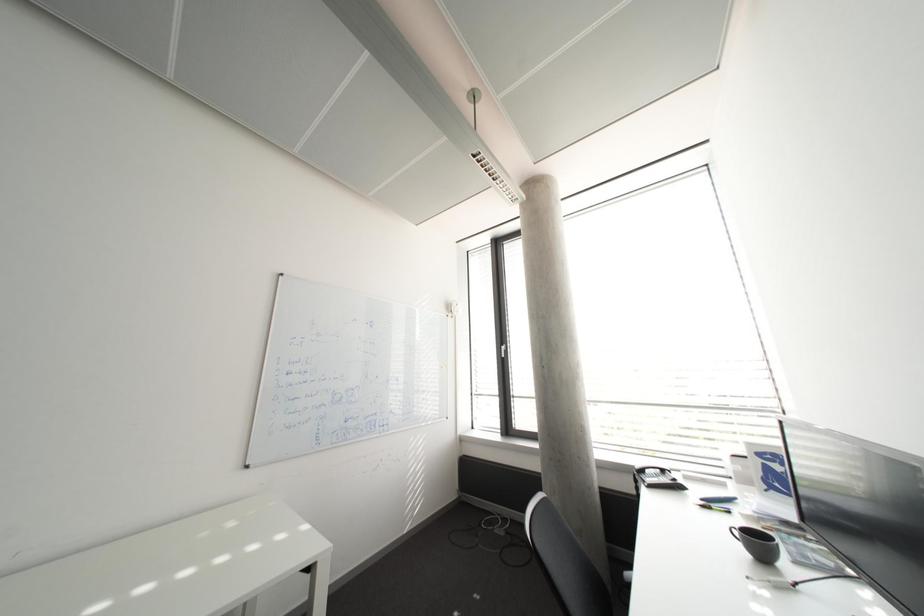
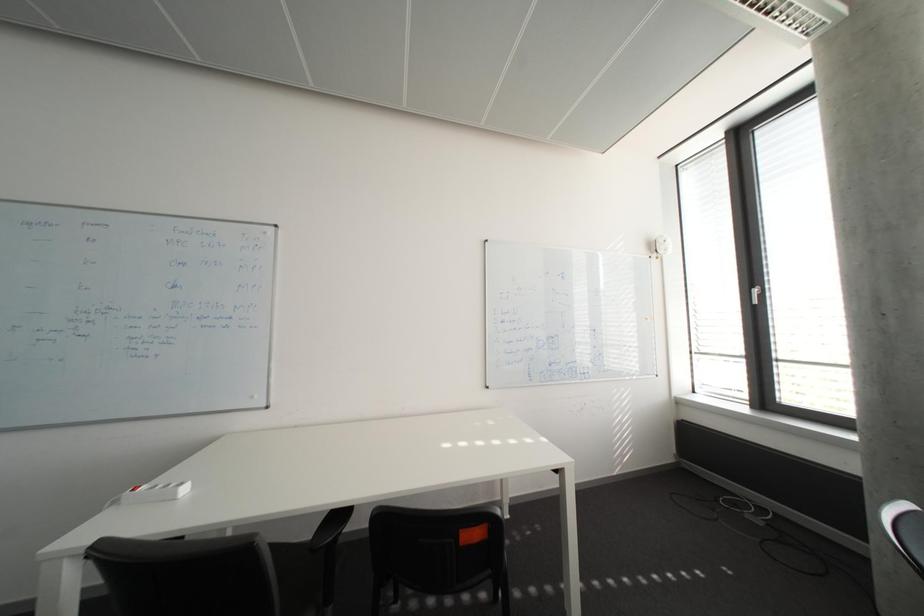
Question: The first image is from the beginning of the video and the second image is from the end. How did the camera likely rotate when shooting the video?

Choices:
 (A) Left
 (B) Right
 (C) Up
 (D) Down

Answer: (A)